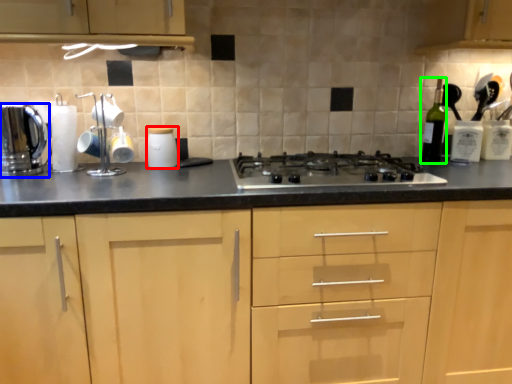
Question: Which object is positioned farthest from kitchen appliance (highlighted by a red box)? Select from kitchen appliance (highlighted by a blue box) and bottle (highlighted by a green box).

Choices:
 (A) kitchen appliance
 (B) bottle

Answer: (B)